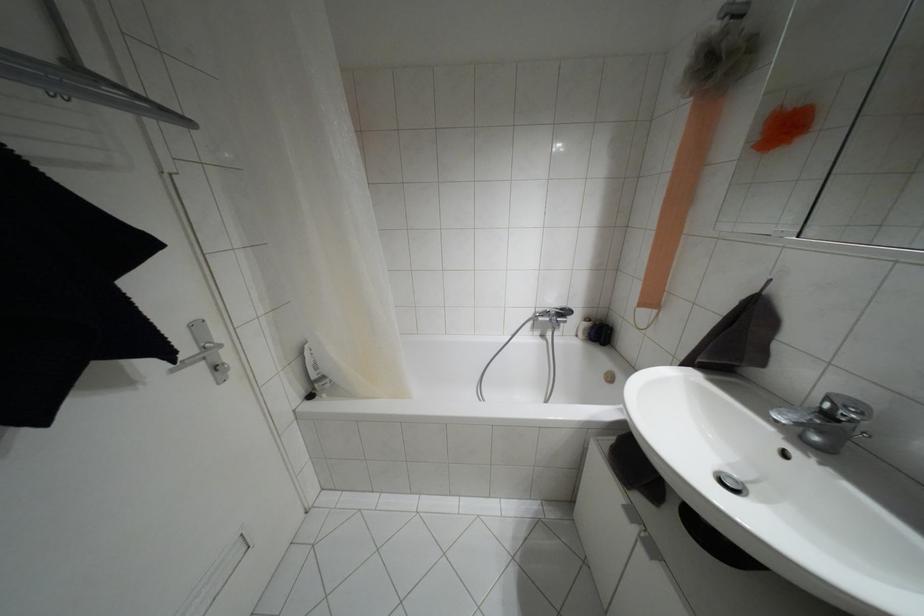
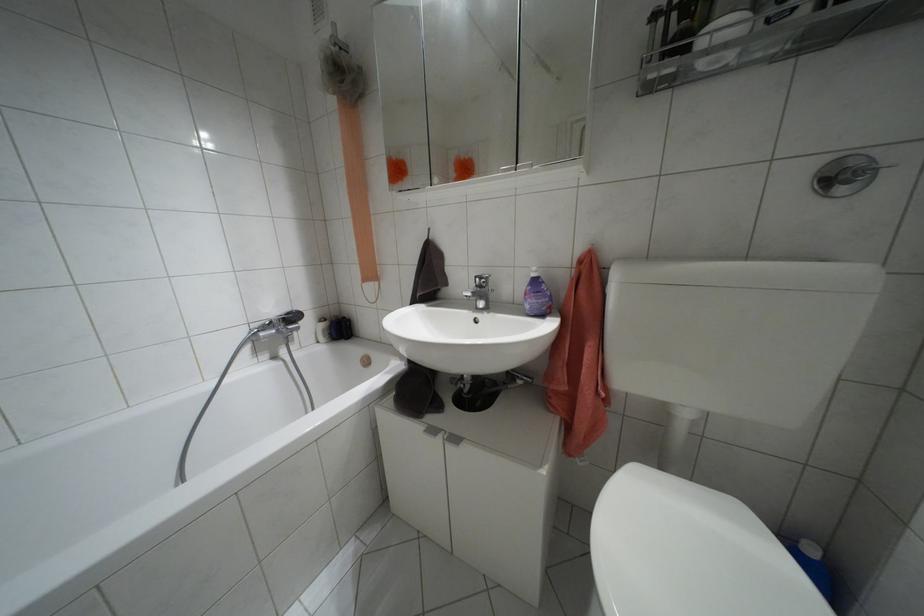
Locate, in the second image, the point that corresponds to point (631, 513) in the first image.

(432, 430)